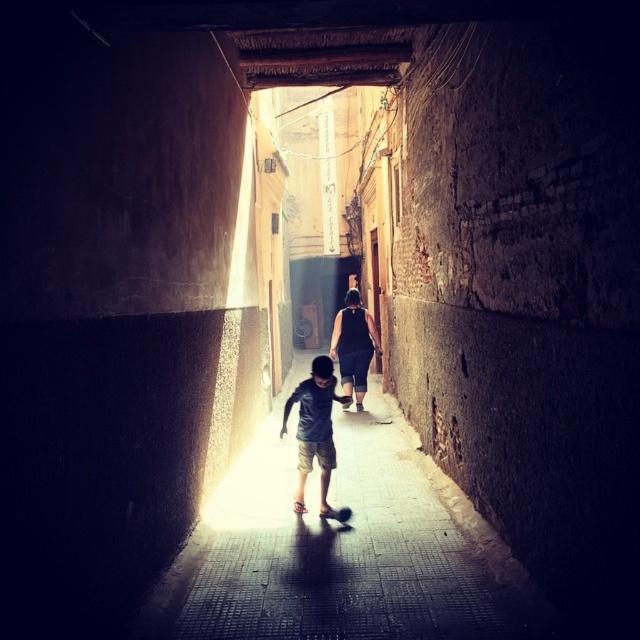
Who is lower down, smooth concrete sidewalk at center or black matte dress at center?

smooth concrete sidewalk at center is below.

Can you confirm if smooth concrete sidewalk at center is positioned above black matte dress at center?

Incorrect, smooth concrete sidewalk at center is not positioned above black matte dress at center.

Does point (330, 536) come in front of point (378, 342)?

Yes, it is in front of point (378, 342).

The width and height of the screenshot is (640, 640). What are the coordinates of `smooth concrete sidewalk at center` in the screenshot? It's located at (340, 550).

Is point (394, 550) farther from camera compared to point (310, 456)?

No.

Is smooth concrete sidewalk at center below dark gray cotton shirt at center?

Yes, smooth concrete sidewalk at center is below dark gray cotton shirt at center.

What are the coordinates of `smooth concrete sidewalk at center` in the screenshot? It's located at (340, 550).

Who is taller, dark gray cotton shirt at center or black matte dress at center?

Standing taller between the two is black matte dress at center.

Describe the element at coordinates (316, 432) in the screenshot. I see `dark gray cotton shirt at center` at that location.

Is point (308, 380) positioned in front of point (339, 353)?

Yes, it is.

Identify the location of dark gray cotton shirt at center. This screenshot has height=640, width=640. (316, 432).